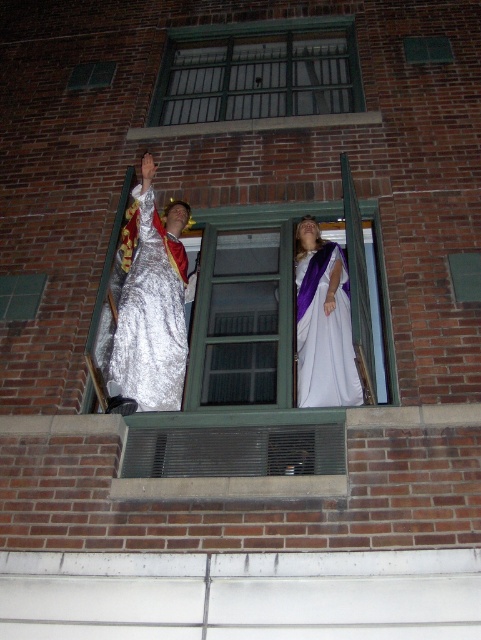
Who is higher up, clear glass window at center or shiny silver gown at left?

shiny silver gown at left is above.

Which of these two, clear glass window at center or shiny silver gown at left, stands taller?

shiny silver gown at left

Which is in front, point (264, 228) or point (150, 252)?

Point (150, 252)

Find the location of a particular element. This screenshot has height=640, width=481. clear glass window at center is located at coordinates (242, 317).

Who is taller, green metal bars at upper center or clear glass window at center?

With more height is clear glass window at center.

Image resolution: width=481 pixels, height=640 pixels. Identify the location of green metal bars at upper center. (257, 72).

From the picture: Does green metal bars at upper center appear on the left side of shiny silver gown at left?

Incorrect, green metal bars at upper center is not on the left side of shiny silver gown at left.

From the picture: Who is more forward, (337,20) or (174,278)?

Point (174,278)

Identify the location of green metal bars at upper center. This screenshot has width=481, height=640. (257, 72).